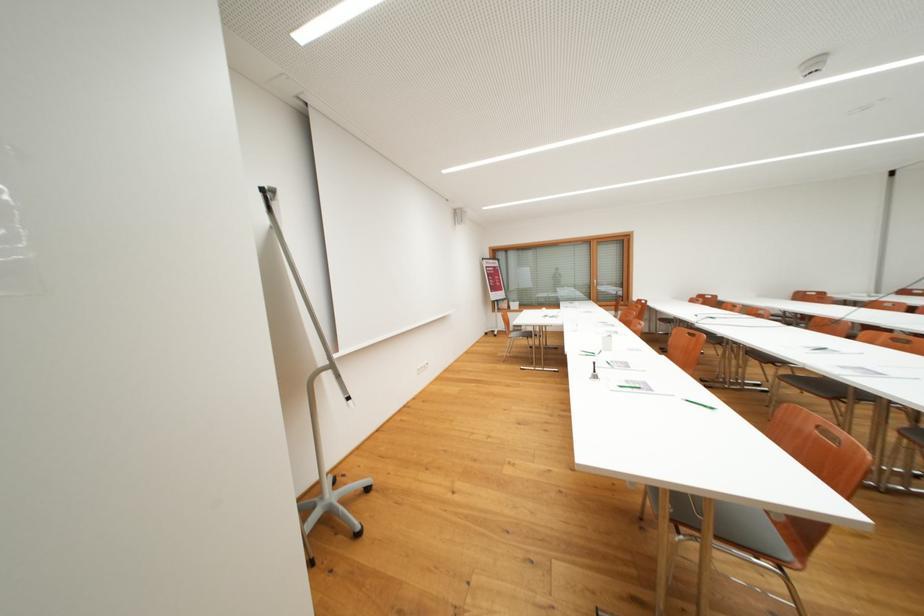
Locate an element on the screen. orange chair sitting surface is located at coordinates point(730,522).